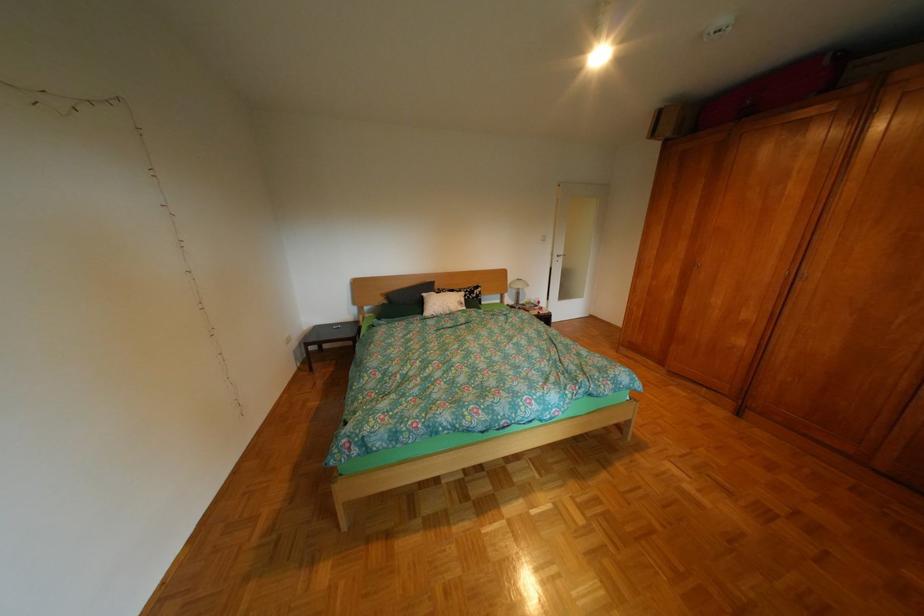
The width and height of the screenshot is (924, 616). Describe the element at coordinates (669, 121) in the screenshot. I see `the brown box` at that location.